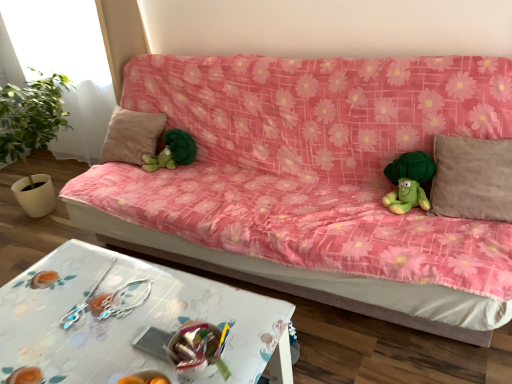
Question: From the image's perspective, relative to beige fabric pillow at center, acting as the 2th pillow starting from the right, is pink floral fabric couch at center above or below?

Choices:
 (A) below
 (B) above

Answer: (A)

Question: In the image, is pink floral fabric couch at center positioned in front of or behind beige fabric pillow at center, the 2th pillow when ordered from front to back?

Choices:
 (A) front
 (B) behind

Answer: (A)

Question: Estimate the real-world distances between objects in this image. Which object is farther from the green plush toy at center, which is the first toy from back to front?

Choices:
 (A) silver metallic earrings at lower center
 (B) pink floral fabric couch at center
 (C) white glossy table at lower center
 (D) transparent glass window at upper left
 (E) green plush toy at right, positioned as the 1th toy in right-to-left order

Answer: (D)

Question: Estimate the real-world distances between objects in this image. Which object is farther from the green plush toy at right, which is the first toy in front-to-back order?

Choices:
 (A) white glossy table at lower center
 (B) silver metallic earrings at lower center
 (C) beige fabric pillow at right, which ranks as the first pillow in front-to-back order
 (D) transparent glass window at upper left
 (E) beige fabric pillow at center, placed as the first pillow when sorted from left to right

Answer: (D)